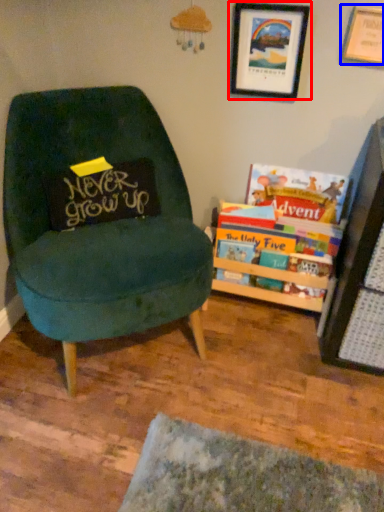
Question: Which object is further to the camera taking this photo, picture frame (highlighted by a red box) or picture frame (highlighted by a blue box)?

Choices:
 (A) picture frame
 (B) picture frame

Answer: (A)